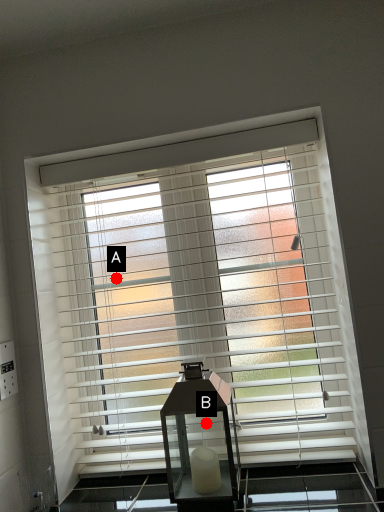
Question: Two points are circled on the image, labeled by A and B beside each circle. Which of the following is the closest to the observer?

Choices:
 (A) A is closer
 (B) B is closer

Answer: (A)